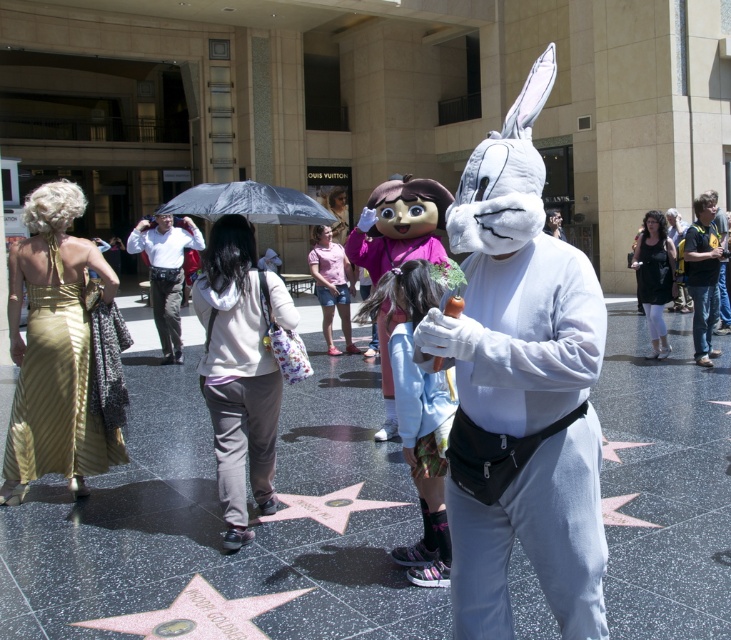
Between point (561, 440) and point (610, 452), which one is positioned behind?

Point (610, 452)

Is white plush rabbit at center shorter than silver reflective star at center?

No.

This screenshot has width=731, height=640. Find the location of `white plush rabbit at center`. white plush rabbit at center is located at coordinates (520, 388).

Locate an element on the screen. The width and height of the screenshot is (731, 640). white plush rabbit at center is located at coordinates (520, 388).

Can you confirm if light gray fleece hoodie at center is taller than gold reflective star at center?

Correct, light gray fleece hoodie at center is much taller as gold reflective star at center.

Can you confirm if light gray fleece hoodie at center is positioned above gold reflective star at center?

Correct, light gray fleece hoodie at center is located above gold reflective star at center.

This screenshot has height=640, width=731. In order to click on light gray fleece hoodie at center in this screenshot , I will do `click(238, 392)`.

Where is `light gray fleece hoodie at center`? light gray fleece hoodie at center is located at coordinates (238, 392).

The image size is (731, 640). I want to click on white plush rabbit at center, so (x=520, y=388).

Is white plush rabbit at center taller than black matte dress at center?

Yes, white plush rabbit at center is taller than black matte dress at center.

Where is `white plush rabbit at center`? The image size is (731, 640). white plush rabbit at center is located at coordinates (520, 388).

Where is `white plush rabbit at center`? This screenshot has height=640, width=731. white plush rabbit at center is located at coordinates 520,388.